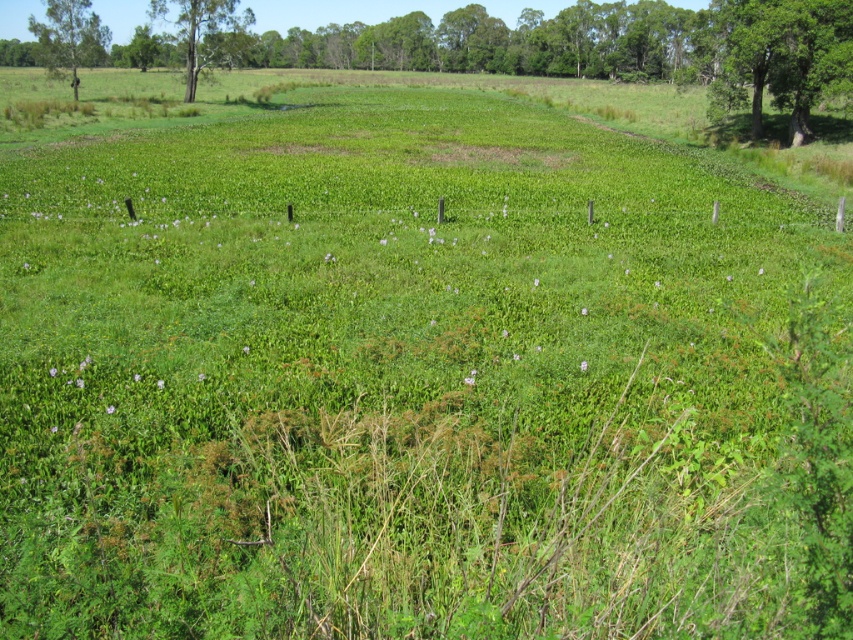
You are a park ranger planning to install a new bench in the field. The bench requires a clear space of 100 feet between any trees to ensure safety. Based on the image, can you place the bench between the green leafy tree at upper right and the green leafy tree at upper left?

The green leafy tree at upper right is 152.10 feet away from the green leafy tree at upper left. Since the required clear space is 100 feet, the distance between them is sufficient, so the bench can be placed between them.

You are standing in the field and see the point marked at coordinates (780, 58). What object is located at that point?

The point at coordinates (780, 58) indicates a green leafy tree at upper right.

You are a bird looking for a nesting spot. You see a smooth bark tree at upper left and a green leafy tree at upper left. Which tree would you choose for nesting based on their sizes?

The green leafy tree at upper left is larger than the smooth bark tree at upper left, so the bird would choose the green leafy tree at upper left for nesting because it offers more space and stability.